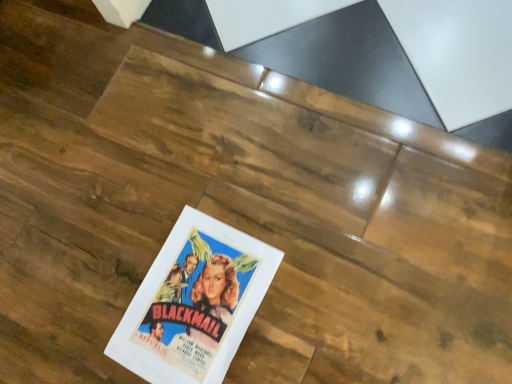
Find the location of a particular element. This screenshot has width=512, height=384. vacant area on the back side of matte paper poster at center is located at coordinates (151, 192).